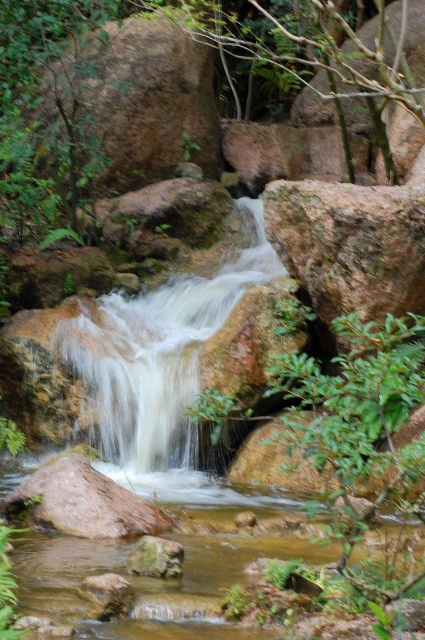
Question: Is smooth rock waterfall at center thinner than smooth brown rock at lower center?

Choices:
 (A) yes
 (B) no

Answer: (B)

Question: Which object is positioned farthest from the gray rough rock at center?

Choices:
 (A) smooth brown rock at center
 (B) rustic granite boulder at upper left
 (C) smooth brown rock at lower center

Answer: (B)

Question: Which object is farther from the camera taking this photo?

Choices:
 (A) rustic granite boulder at upper left
 (B) gray rough rock at center
 (C) smooth rock waterfall at center

Answer: (A)

Question: Does smooth brown rock at center appear under smooth brown rock at lower center?

Choices:
 (A) no
 (B) yes

Answer: (A)

Question: Based on their relative distances, which object is nearer to the smooth brown rock at lower center?

Choices:
 (A) smooth rock waterfall at center
 (B) rustic granite boulder at upper left

Answer: (A)

Question: Is rustic granite boulder at upper left thinner than gray rough rock at center?

Choices:
 (A) yes
 (B) no

Answer: (B)